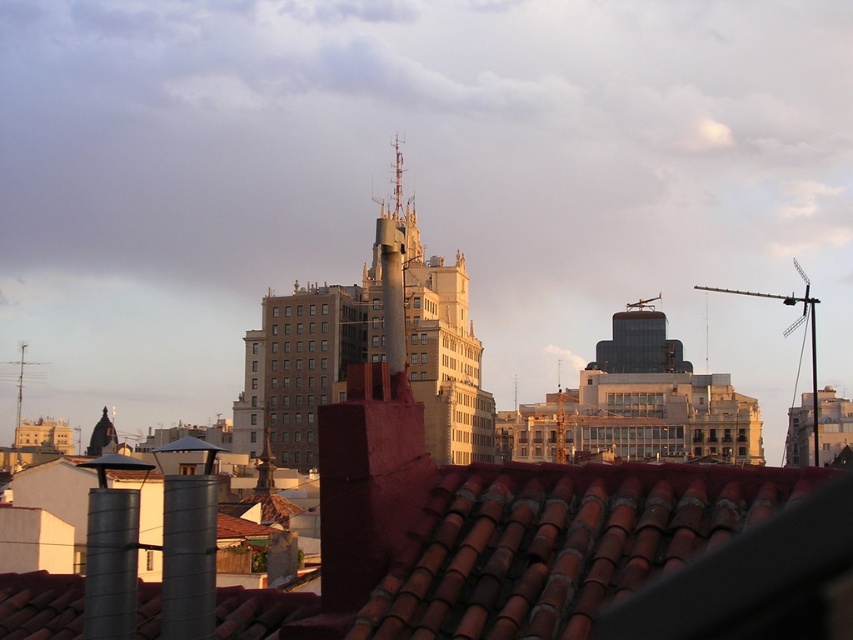
Question: Which object is closer to the camera taking this photo?

Choices:
 (A) brown tile roof at center
 (B) smooth concrete tower at center
 (C) metallic antenna at left

Answer: (A)

Question: Is brown tile roof at center behind metallic antenna at left?

Choices:
 (A) yes
 (B) no

Answer: (B)

Question: Is brown tile roof at center above smooth concrete tower at center?

Choices:
 (A) no
 (B) yes

Answer: (A)

Question: Which point is farther from the camera taking this photo?

Choices:
 (A) (20, 381)
 (B) (683, 499)

Answer: (A)

Question: Does brown tile roof at center have a lesser width compared to smooth concrete tower at center?

Choices:
 (A) yes
 (B) no

Answer: (A)

Question: Which of the following is the farthest from the observer?

Choices:
 (A) brown tile roof at center
 (B) metallic antenna at left

Answer: (B)